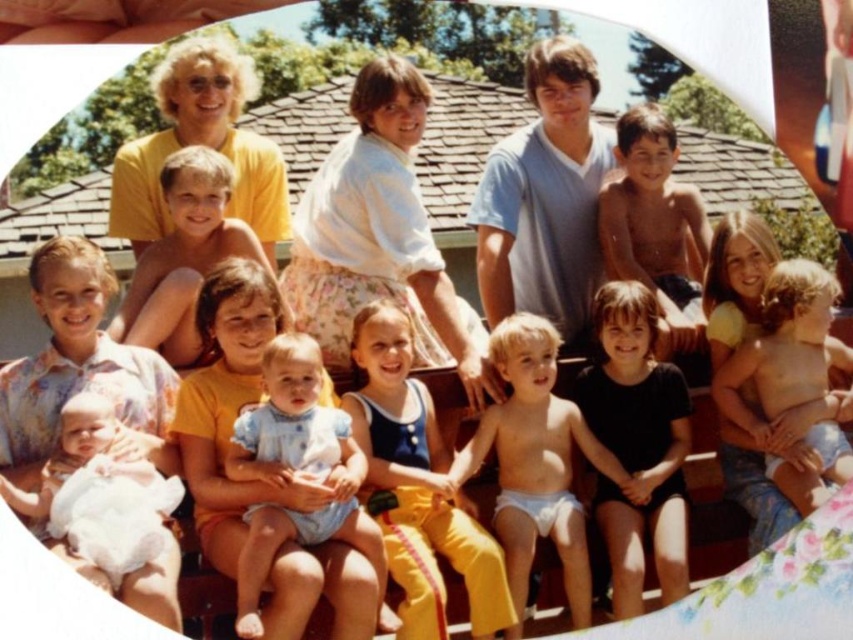
Looking at this image, you are a photographer trying to capture a closeup of the light blue diaper at center and the light brown hair at center. Which object should you focus on first to ensure it appears sharp in the photo?

You should focus on the light blue diaper at center first because it is closer to the viewer than the light brown hair at center, ensuring it will be sharp.

You are organizing a photo album and want to ensure the black matte shirt at center and shiny brown hair at upper right are both visible in the photo. Since the photo is small, you need to know which object takes up more space. Which one is bigger?

The black matte shirt at center is larger in size than the shiny brown hair at upper right, so it takes up more space in the photo.